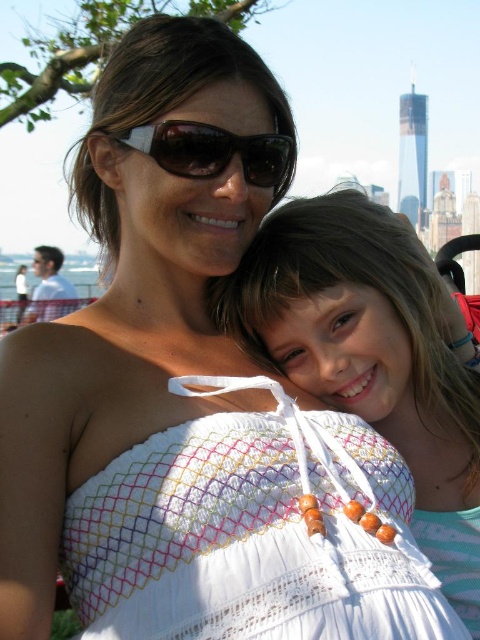
Consider the image. Can you confirm if white crochet dress at center is shorter than white lace dress at center?

Yes, white crochet dress at center is shorter than white lace dress at center.

Based on the photo, between white crochet dress at center and white lace dress at center, which one appears on the right side from the viewer's perspective?

From the viewer's perspective, white lace dress at center appears more on the right side.

Is point (97, 579) in front of point (421, 394)?

That is True.

Find the location of a particular element. white crochet dress at center is located at coordinates (249, 538).

Which of these two, white crochet dress at center or matte black sunglasses at upper center, stands shorter?

matte black sunglasses at upper center is shorter.

Identify the location of white crochet dress at center. (249, 538).

Where is `white crochet dress at center`? The height and width of the screenshot is (640, 480). white crochet dress at center is located at coordinates (249, 538).

Is white lace dress at center to the left of matte black sunglasses at upper center from the viewer's perspective?

No, white lace dress at center is not to the left of matte black sunglasses at upper center.

Is white lace dress at center smaller than matte black sunglasses at upper center?

Incorrect, white lace dress at center is not smaller in size than matte black sunglasses at upper center.

What are the coordinates of `white lace dress at center` in the screenshot? It's located at (371, 355).